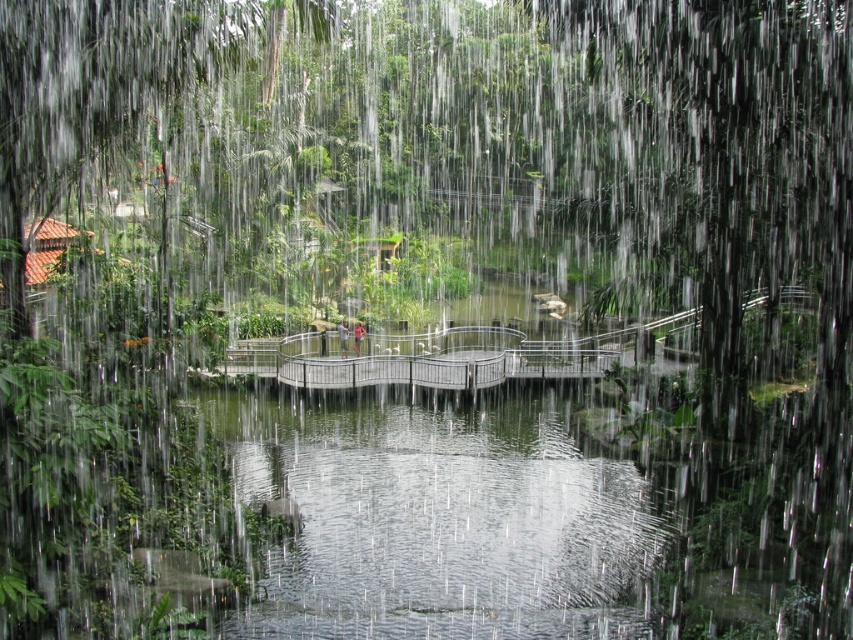
You are a visitor in the garden and want to cross from one side to the other. You see a metallic gray bridge at center and a light brown wooden bridge at center. Which bridge should you take to ensure you can reach the other side without needing to backtrack?

Both the metallic gray bridge at center and the light brown wooden bridge at center are positioned in the center of the garden and are only 4.99 meters apart. Since they are both central structures, taking either bridge would allow you to reach the opposite side without needing to backtrack, as they are positioned to span the water body in the middle.

You are a visitor standing on the light brown wooden bridge at center and want to place your skinny jeans at center on the ground below. Can you reach the ground from the bridge?

The light brown wooden bridge at center has a greater height compared to skinny jeans at center, so yes, you can reach the ground from the bridge to place your skinny jeans at center there.

You are a visitor in the tropical garden and want to cross the metallic gray bridge at center. Based on its position, can you estimate how far it is from the bottom edge of the garden scene?

The metallic gray bridge at center is located at coordinate point (440, 356), which means it is approximately 51.8 percent from the bottom edge of the garden scene. Therefore, it is about halfway up the scene from the bottom.